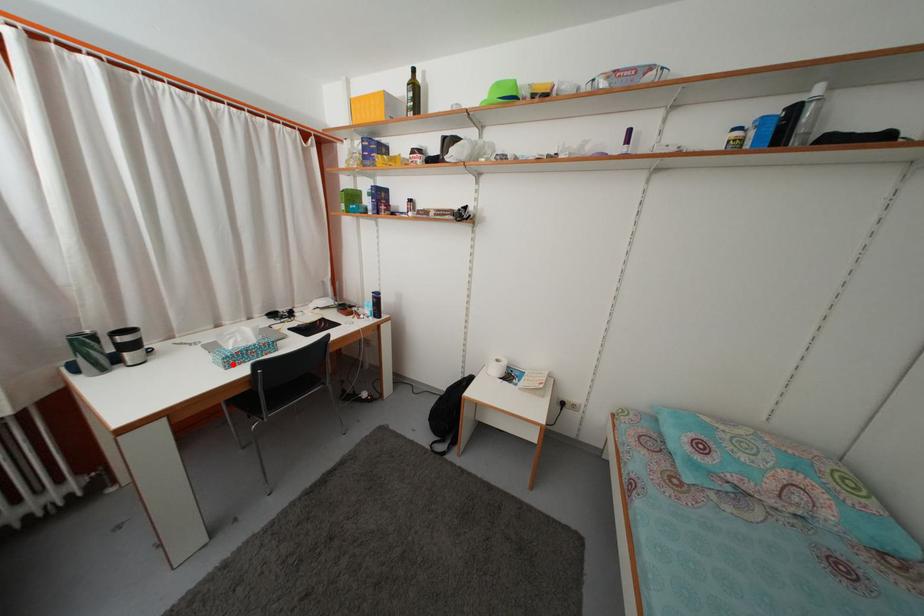
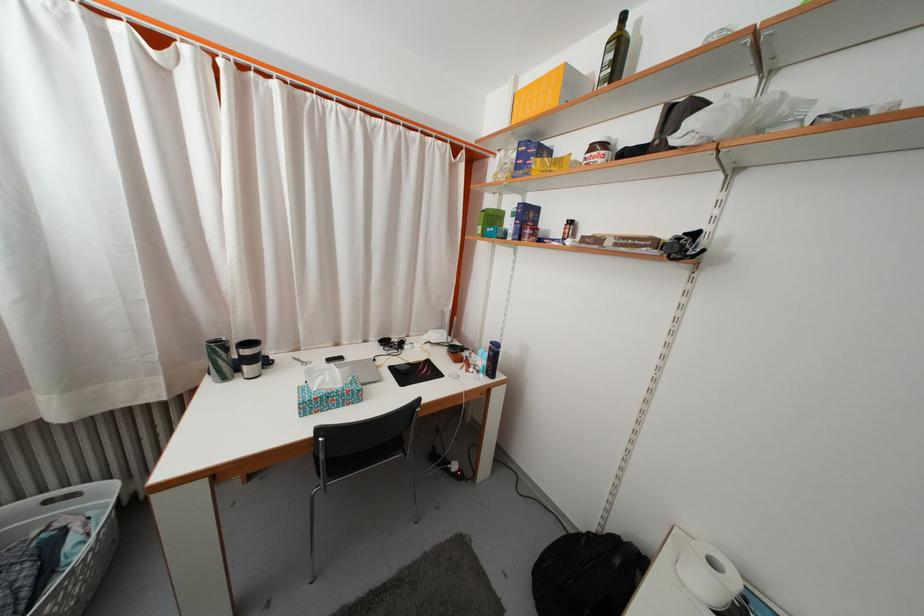
Where in the second image is the point corresponding to the highlighted location from the first image?

(310, 410)